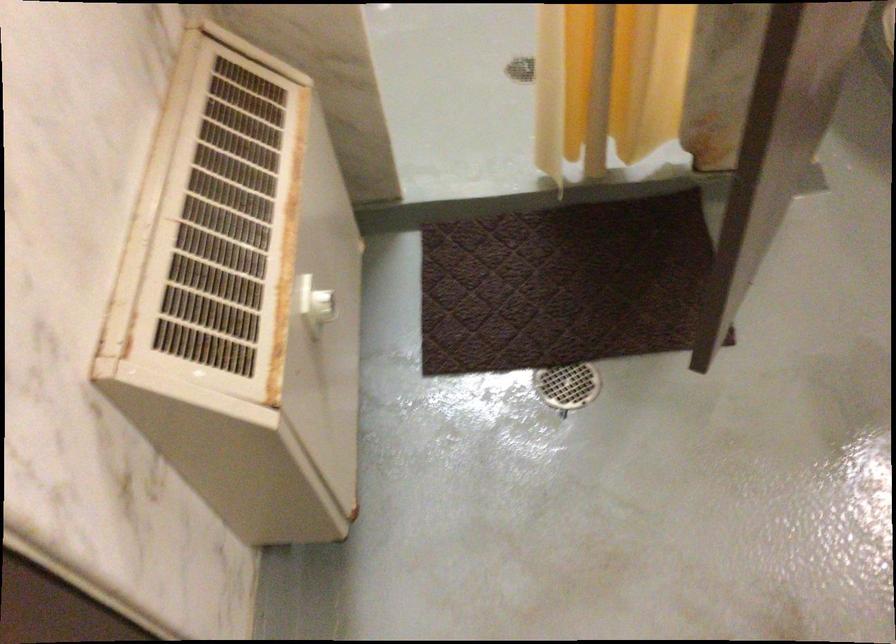
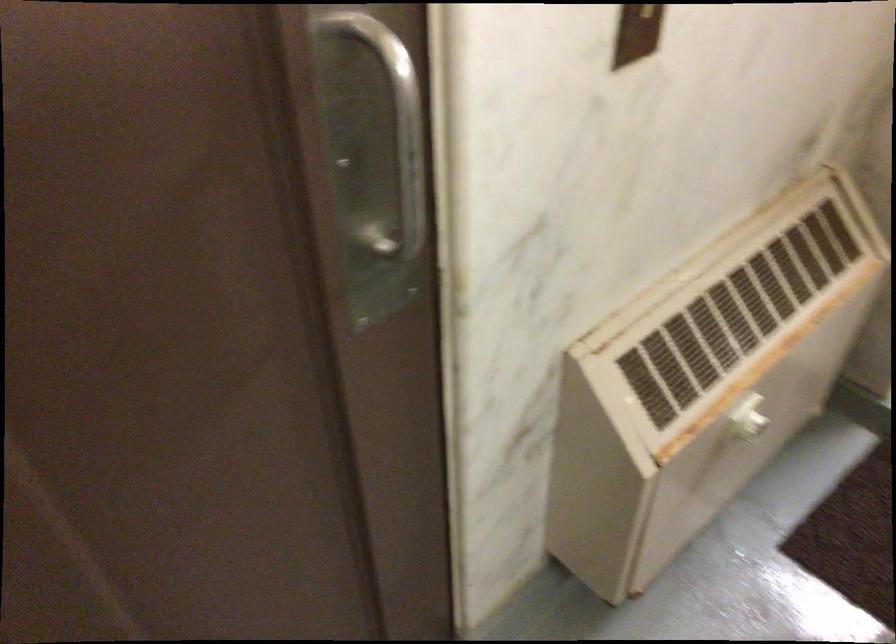
Question: Based on the continuous images, in which direction is the camera rotating? Reply with the corresponding letter.

Choices:
 (A) Left
 (B) Right
 (C) Up
 (D) Down

Answer: (A)